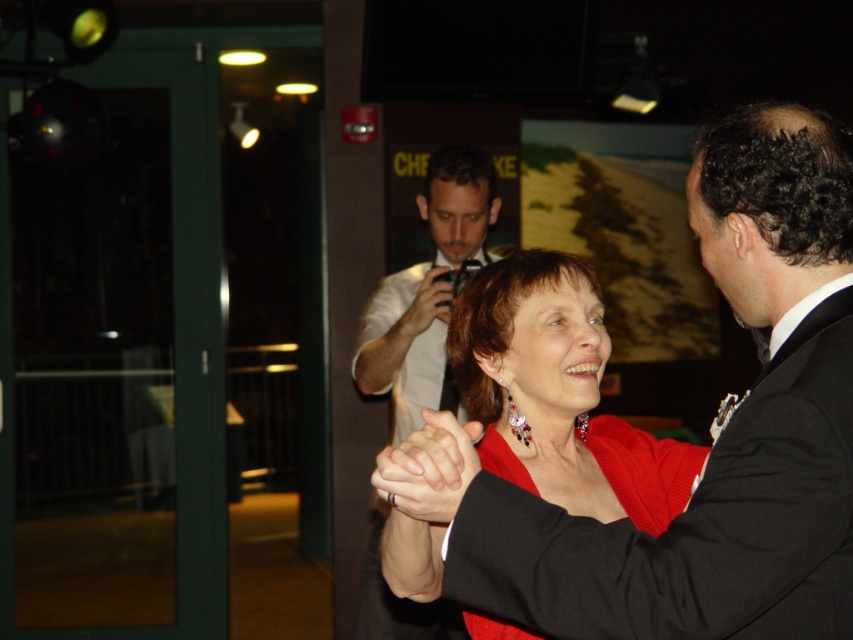
Does matte red dress at center have a lesser height compared to smooth black hand at center?

No.

Can you confirm if matte red dress at center is bigger than smooth black hand at center?

Indeed, matte red dress at center has a larger size compared to smooth black hand at center.

Between point (583, 268) and point (450, 465), which one is positioned behind?

Positioned behind is point (583, 268).

Where is `matte red dress at center`? matte red dress at center is located at coordinates [x=556, y=394].

Does white shirt at center have a lesser height compared to smooth skin hand at center?

Incorrect, white shirt at center's height does not fall short of smooth skin hand at center's.

Does white shirt at center have a larger size compared to smooth skin hand at center?

Yes.

Locate an element on the screen. white shirt at center is located at coordinates (416, 288).

Is matte red dress at center to the left of smooth skin hand at center from the viewer's perspective?

In fact, matte red dress at center is to the right of smooth skin hand at center.

Is matte red dress at center wider than smooth skin hand at center?

Indeed, matte red dress at center has a greater width compared to smooth skin hand at center.

Is point (488, 468) positioned behind point (424, 285)?

That is False.

At what (x,y) coordinates should I click in order to perform the action: click on matte red dress at center. Please return your answer as a coordinate pair (x, y). This screenshot has width=853, height=640. Looking at the image, I should click on (556, 394).